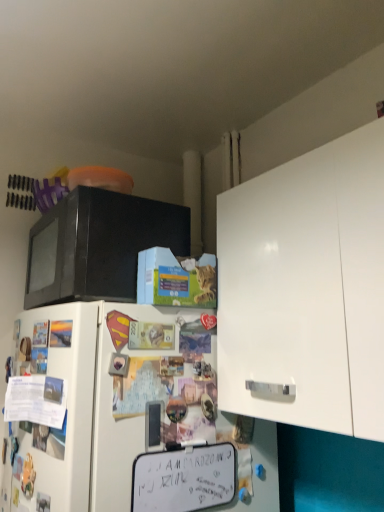
Question: From the image's perspective, is white matte refrigerator at lower left located above or below white matte cabinet at upper right?

Choices:
 (A) below
 (B) above

Answer: (A)

Question: Is white matte refrigerator at lower left in front of or behind white matte cabinet at upper right in the image?

Choices:
 (A) behind
 (B) front

Answer: (A)

Question: Based on their relative distances, which object is nearer to the white matte dry erase board at lower center?

Choices:
 (A) black matte microwave at upper left
 (B) white matte refrigerator at lower left
 (C) white matte cabinet at upper right

Answer: (B)

Question: Which object is the farthest from the white matte cabinet at upper right?

Choices:
 (A) white matte refrigerator at lower left
 (B) black matte microwave at upper left
 (C) white matte dry erase board at lower center

Answer: (C)